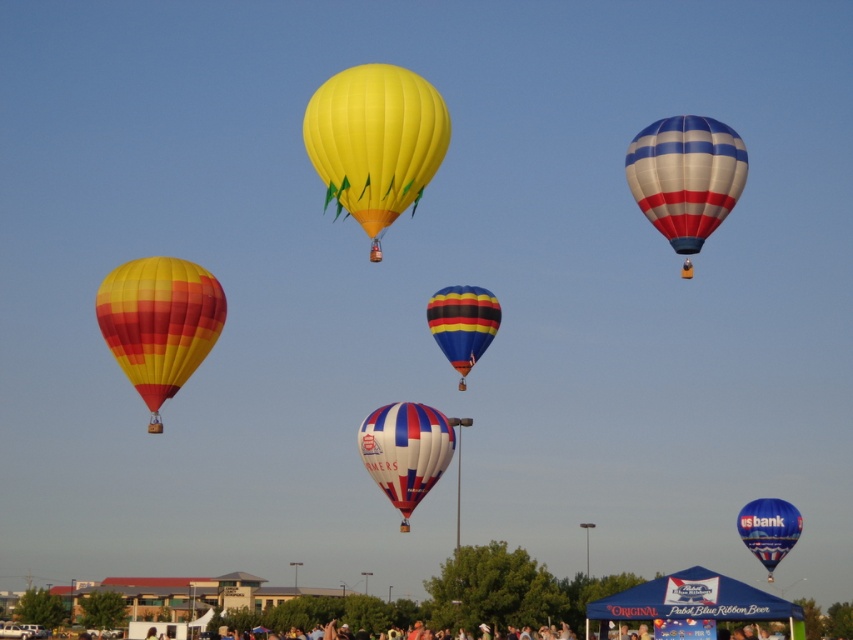
Does striped fabric hot air balloon at center appear over blue glossy hot air balloon at center?

Correct, striped fabric hot air balloon at center is located above blue glossy hot air balloon at center.

Is striped fabric hot air balloon at center in front of blue glossy hot air balloon at center?

Yes, it is.

Describe the element at coordinates (462, 323) in the screenshot. Image resolution: width=853 pixels, height=640 pixels. I see `striped fabric hot air balloon at center` at that location.

This screenshot has width=853, height=640. In order to click on striped fabric hot air balloon at center in this screenshot , I will do `click(462, 323)`.

Who is more distant from viewer, (x=157, y=410) or (x=387, y=467)?

The point (x=387, y=467) is behind.

Image resolution: width=853 pixels, height=640 pixels. Find the location of `matte striped balloon at left`. matte striped balloon at left is located at coordinates (160, 323).

Can you confirm if white and blue striped balloon at center is taller than blue glossy hot air balloon at center?

Correct, white and blue striped balloon at center is much taller as blue glossy hot air balloon at center.

Describe the element at coordinates (405, 451) in the screenshot. The width and height of the screenshot is (853, 640). I see `white and blue striped balloon at center` at that location.

Locate an element on the screen. white and blue striped balloon at center is located at coordinates (405, 451).